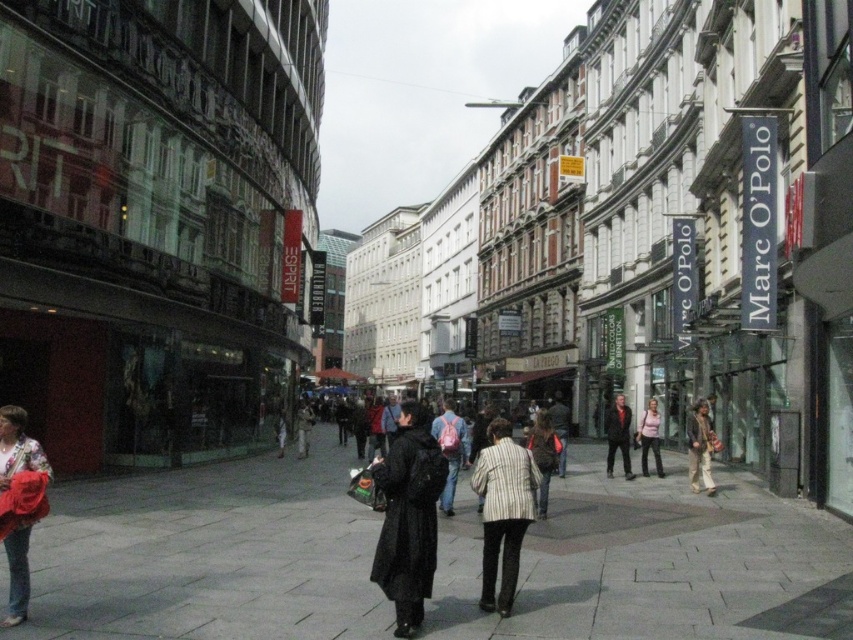
Question: Which object appears farthest from the camera in this image?

Choices:
 (A) black matte coat at center
 (B) leather jacket at center
 (C) striped fabric coat at center

Answer: (B)

Question: From the image, what is the correct spatial relationship of matte pink backpack at center in relation to dark coat at center?

Choices:
 (A) below
 (B) above

Answer: (B)

Question: Can you confirm if leather jacket at center is positioned above dark coat at center?

Choices:
 (A) no
 (B) yes

Answer: (B)

Question: Is gray stone pavement at center wider than dark coat at center?

Choices:
 (A) no
 (B) yes

Answer: (B)

Question: Which object is farther from the camera taking this photo?

Choices:
 (A) dark brown leather jacket at center
 (B) striped fabric coat at center
 (C) striped fabric jacket at center

Answer: (A)

Question: Which point is closer to the camera?

Choices:
 (A) leather jacket at center
 (B) gray stone pavement at center
 (C) striped fabric jacket at center
 (D) matte pink backpack at center

Answer: (B)